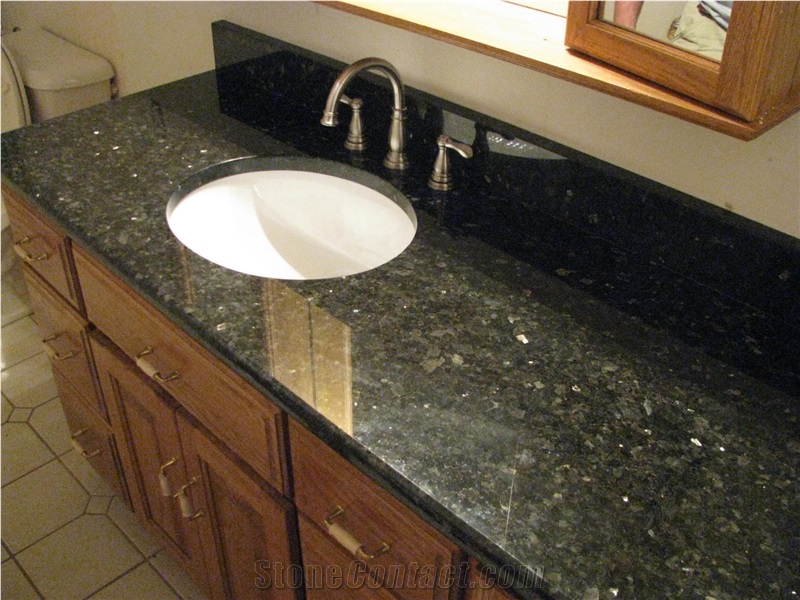
Where is `toilet`? toilet is located at coordinates (14, 80).